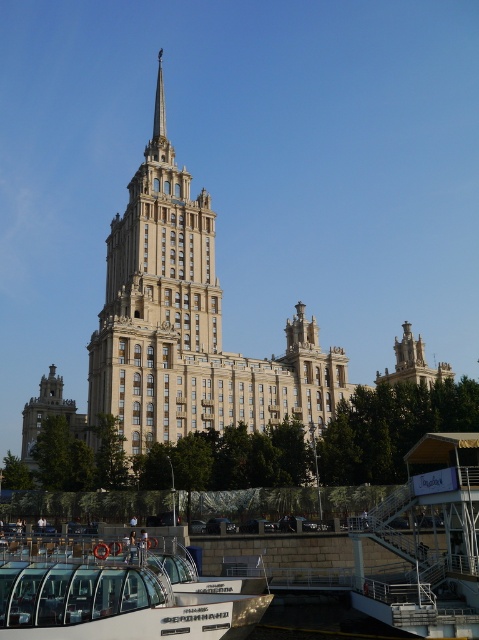
Question: Estimate the real-world distances between objects in this image. Which object is closer to the white glass boat at lower left?

Choices:
 (A) matte gold tower at lower left
 (B) beige stone building at center

Answer: (B)

Question: Based on their relative distances, which object is nearer to the matte gold tower at lower left?

Choices:
 (A) beige stone building at center
 (B) white glass boat at lower left

Answer: (A)

Question: Does beige stone building at center lie behind white glass boat at lower left?

Choices:
 (A) yes
 (B) no

Answer: (A)

Question: Does beige stone building at center appear on the right side of matte gold tower at lower left?

Choices:
 (A) yes
 (B) no

Answer: (A)

Question: Which object appears farthest from the camera in this image?

Choices:
 (A) matte gold tower at lower left
 (B) beige stone building at center
 (C) white glass boat at lower left

Answer: (A)

Question: Is white glass boat at lower left positioned in front of matte gold tower at lower left?

Choices:
 (A) yes
 (B) no

Answer: (A)